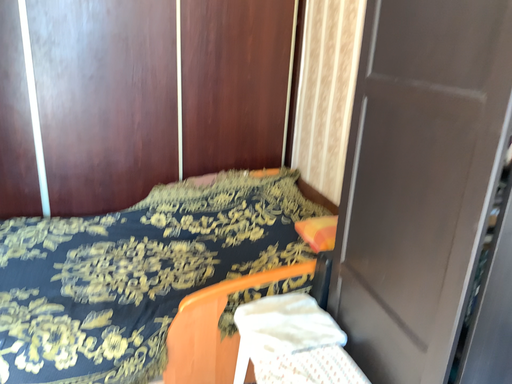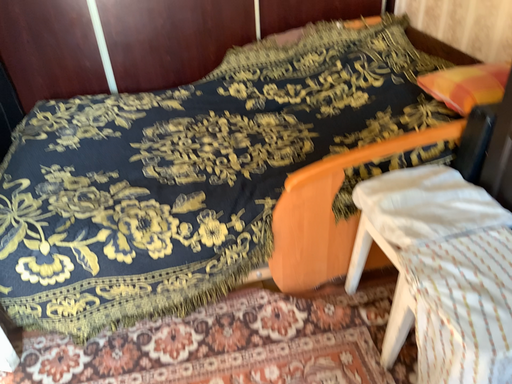
Question: Which way did the camera rotate in the video?

Choices:
 (A) rotated right
 (B) rotated left

Answer: (B)